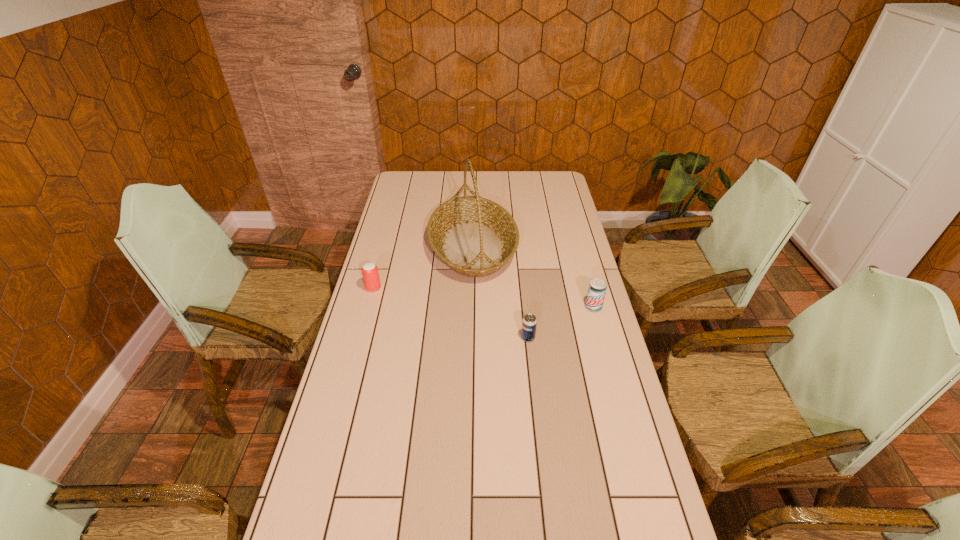
Identify the location of vacant region between the second farthest beer can and the basket. The width and height of the screenshot is (960, 540). (533, 276).

This screenshot has height=540, width=960. I want to click on blank region between the second nearest beer can and the basket, so click(533, 276).

The width and height of the screenshot is (960, 540). Identify the location of free spot between the leftmost object and the basket. (423, 267).

The width and height of the screenshot is (960, 540). Find the location of `free space between the rightmost object and the leftmost beer can`. free space between the rightmost object and the leftmost beer can is located at coordinates (484, 298).

Where is `vacant area that lies between the leftmost beer can and the nearest beer can`? Image resolution: width=960 pixels, height=540 pixels. vacant area that lies between the leftmost beer can and the nearest beer can is located at coordinates (451, 313).

This screenshot has height=540, width=960. Find the location of `free spot between the shortest beer can and the leftmost beer can`. free spot between the shortest beer can and the leftmost beer can is located at coordinates (451, 313).

Find the location of `vacant space in between the tallest object and the shortest beer can`. vacant space in between the tallest object and the shortest beer can is located at coordinates [500, 292].

Image resolution: width=960 pixels, height=540 pixels. I want to click on object that can be found as the third closest to the rightmost beer can, so click(x=370, y=273).

Select which object is the closest to the second beer can from right to left. Please provide its 2D coordinates. Your answer should be formatted as a tuple, i.e. [(x, y)], where the tuple contains the x and y coordinates of a point satisfying the conditions above.

[(597, 289)]

Where is `beer can that stands as the second closest to the tallest object`? This screenshot has height=540, width=960. beer can that stands as the second closest to the tallest object is located at coordinates (529, 323).